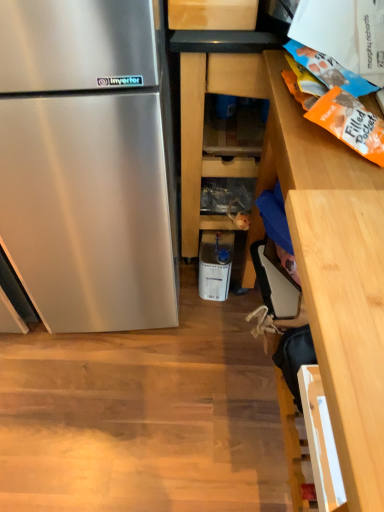
Question: Is wooden shelves at center, arranged as the 1th cabinetry when viewed from the left, in front of white plastic container at center?

Choices:
 (A) no
 (B) yes

Answer: (B)

Question: From the image's perspective, is wooden shelves at center, arranged as the 1th cabinetry when viewed from the left, beneath white plastic container at center?

Choices:
 (A) no
 (B) yes

Answer: (A)

Question: Does wooden shelves at center, arranged as the 1th cabinetry when viewed from the left, have a greater width compared to white plastic container at center?

Choices:
 (A) yes
 (B) no

Answer: (A)

Question: Does wooden shelves at center, arranged as the 1th cabinetry when viewed from the left, appear on the right side of white plastic container at center?

Choices:
 (A) no
 (B) yes

Answer: (B)

Question: From a real-world perspective, is wooden shelves at center, which ranks as the 2th cabinetry in right-to-left order, located beneath white plastic container at center?

Choices:
 (A) yes
 (B) no

Answer: (B)

Question: Is wooden shelves at center, arranged as the 1th cabinetry when viewed from the left, with white plastic container at center?

Choices:
 (A) yes
 (B) no

Answer: (B)

Question: Would you say wooden cabinet at right, arranged as the first cabinetry when viewed from the right, is part of white plastic container at center's contents?

Choices:
 (A) no
 (B) yes

Answer: (A)

Question: Is white plastic container at center facing away from wooden cabinet at right, which is counted as the second cabinetry, starting from the left?

Choices:
 (A) yes
 (B) no

Answer: (B)

Question: Is white plastic container at center not close to wooden cabinet at right, arranged as the first cabinetry when viewed from the right?

Choices:
 (A) no
 (B) yes

Answer: (A)

Question: Can you confirm if white plastic container at center is positioned to the right of wooden cabinet at right, which is counted as the second cabinetry, starting from the left?

Choices:
 (A) yes
 (B) no

Answer: (B)

Question: Can you confirm if white plastic container at center is bigger than wooden cabinet at right, which is counted as the second cabinetry, starting from the left?

Choices:
 (A) no
 (B) yes

Answer: (A)

Question: From the image's perspective, is white plastic container at center on wooden cabinet at right, which is counted as the second cabinetry, starting from the left?

Choices:
 (A) yes
 (B) no

Answer: (A)

Question: Is wooden cabinet at right, arranged as the first cabinetry when viewed from the right, positioned far away from wooden shelves at center, which ranks as the 2th cabinetry in right-to-left order?

Choices:
 (A) yes
 (B) no

Answer: (B)